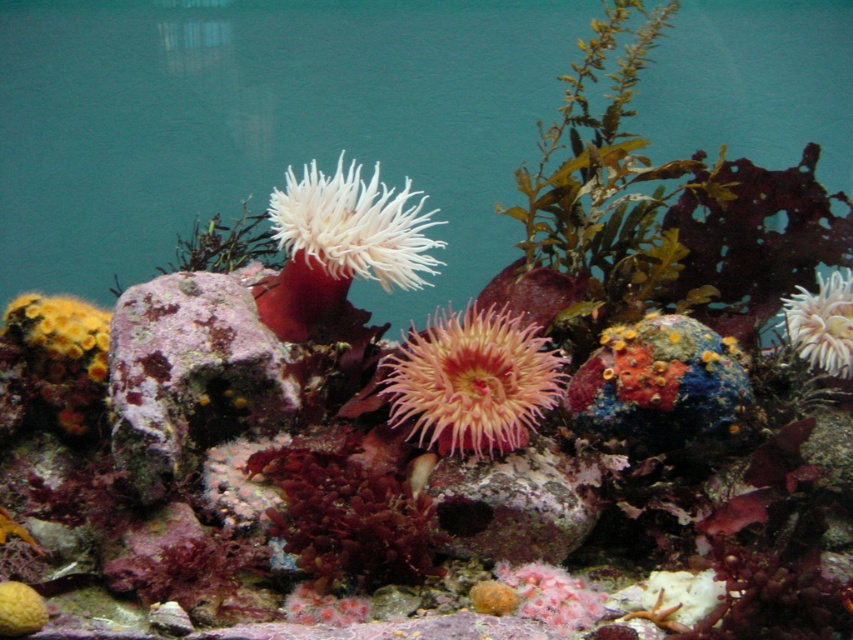
Question: Does multicolored coral at center appear on the left side of white fluffy anemone at upper right?

Choices:
 (A) yes
 (B) no

Answer: (A)

Question: Which point is closer to the camera?

Choices:
 (A) (335, 237)
 (B) (635, 378)
 (C) (285, 353)

Answer: (B)

Question: Is rusty coral rock at center to the right of white fluffy anemone at center from the viewer's perspective?

Choices:
 (A) yes
 (B) no

Answer: (B)

Question: Which of the following is the farthest from the observer?

Choices:
 (A) pink soft coral at center
 (B) green leafy plant at upper right
 (C) white fluffy anemone at center

Answer: (B)

Question: Which point is farther to the camera?

Choices:
 (A) white fluffy anemone at upper right
 (B) pink soft coral at center
 (C) green leafy plant at upper right

Answer: (C)

Question: From the image, what is the correct spatial relationship of green leafy plant at upper right in relation to pink soft coral at center?

Choices:
 (A) below
 (B) above

Answer: (B)